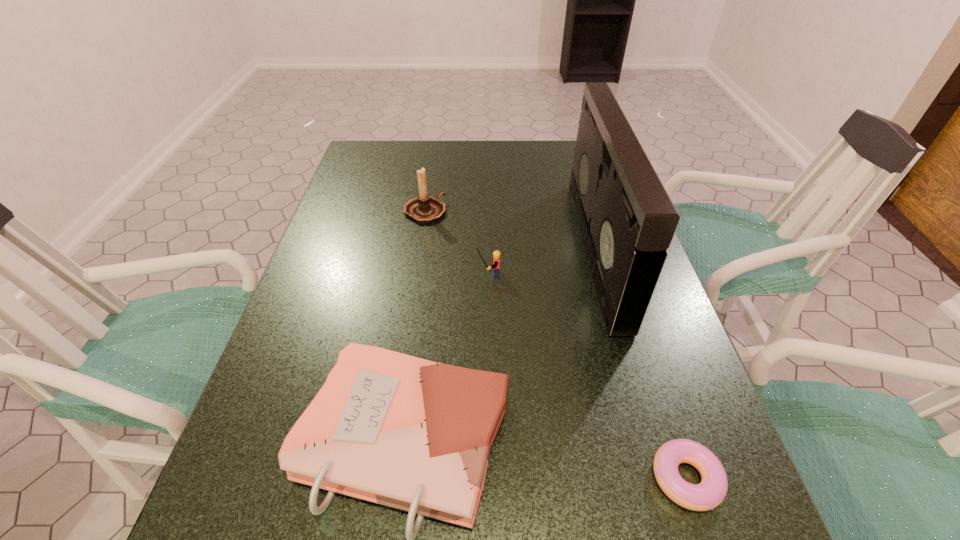
This screenshot has height=540, width=960. What are the coordinates of `videotape` in the screenshot? It's located at (627, 220).

Locate an element on the screen. This screenshot has width=960, height=540. candle holder is located at coordinates (424, 209).

Identify the location of the third shortest object. Image resolution: width=960 pixels, height=540 pixels. (496, 254).

The height and width of the screenshot is (540, 960). I want to click on doughnut, so click(711, 491).

The height and width of the screenshot is (540, 960). I want to click on vacant space situated 0.370m on the front side of the videotape, so click(440, 249).

Locate an element on the screen. blank space located 0.170m on the front side of the videotape is located at coordinates (517, 249).

The height and width of the screenshot is (540, 960). Identify the location of free space located on the front side of the videotape. (514, 249).

Locate an element on the screen. The width and height of the screenshot is (960, 540). free spot located on the back of the second tallest object is located at coordinates pyautogui.click(x=430, y=181).

Image resolution: width=960 pixels, height=540 pixels. I want to click on vacant space located on the front-facing side of the third shortest object, so click(x=331, y=274).

What are the coordinates of `vacant space located 0.050m on the front-facing side of the third shortest object` in the screenshot? It's located at (456, 274).